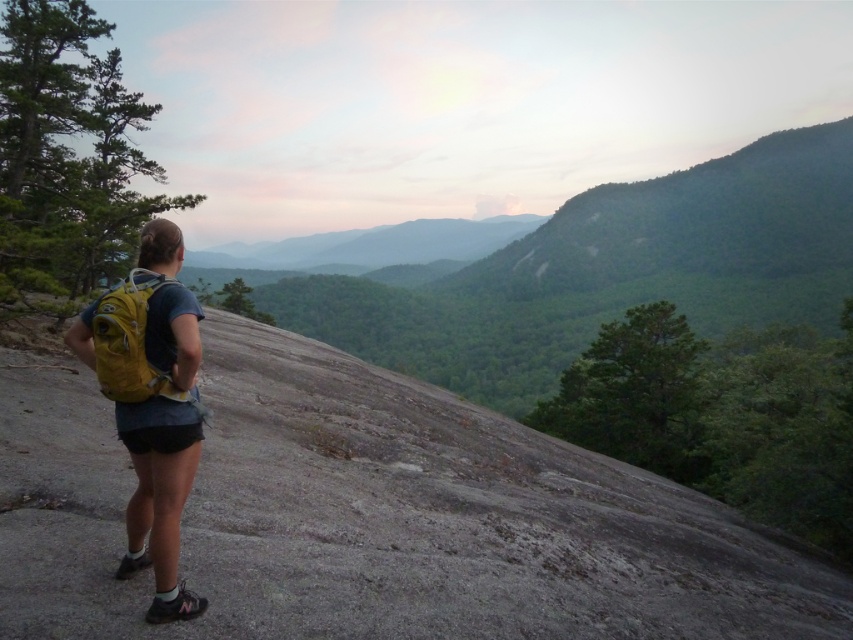
Question: Is yellow fabric backpack at left positioned in front of yellow fabric backpack at center?

Choices:
 (A) yes
 (B) no

Answer: (A)

Question: Can you confirm if yellow fabric backpack at left is positioned to the right of yellow fabric backpack at center?

Choices:
 (A) yes
 (B) no

Answer: (B)

Question: Which point is farther to the camera?

Choices:
 (A) yellow fabric backpack at center
 (B) yellow fabric backpack at left

Answer: (A)

Question: Which of the following is the farthest from the observer?

Choices:
 (A) (180, 390)
 (B) (126, 328)

Answer: (A)

Question: Is yellow fabric backpack at left positioned before yellow fabric backpack at center?

Choices:
 (A) no
 (B) yes

Answer: (B)